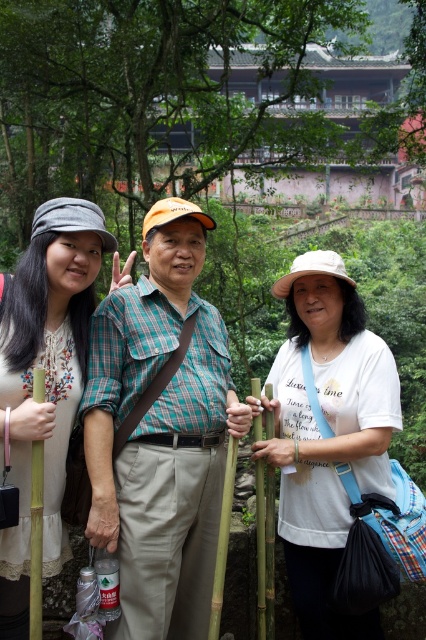
You are taking a photo of the two points in the scene. The first point is at coordinate point (74, 243) and the second is at point (256, 522). Which point will appear larger in your photo?

Point (74, 243) is further to the camera than point (256, 522), so it will appear larger in the photo.

You are a photographer trying to capture a photo of the matte white blouse at left and the green bamboo pole at left. Based on their positions, which object is closer to the right side of the frame?

The matte white blouse at left is closer to the right side of the frame because it is positioned to the right of the green bamboo pole at left.